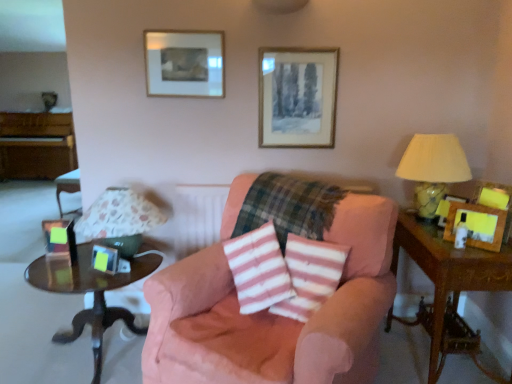
Question: From the image's perspective, is wooden side table at right, marked as the 2th table in a left-to-right arrangement, above or below yellow fabric lampshade at right, the 2th table lamp viewed from the left?

Choices:
 (A) above
 (B) below

Answer: (B)

Question: Considering the positions of wooden side table at right, marked as the 2th table in a left-to-right arrangement, and yellow fabric lampshade at right, the 1th table lamp positioned from the right, in the image, is wooden side table at right, marked as the 2th table in a left-to-right arrangement, wider or thinner than yellow fabric lampshade at right, the 1th table lamp positioned from the right,?

Choices:
 (A) thin
 (B) wide

Answer: (B)

Question: Which object is positioned closest to the plaid fabric at center?

Choices:
 (A) wooden side table at right, marked as the 2th table in a left-to-right arrangement
 (B) metallic silver picture frame at lower left, the 4th picture frame positioned from the back
 (C) wooden picture frame at right, the first picture frame viewed from the right
 (D) wooden side table at left, the 1th table positioned from the left
 (E) pink fabric chair at center

Answer: (E)

Question: Which object is positioned farthest from the wooden picture frame at right, placed as the 3th picture frame when sorted from bottom to top?

Choices:
 (A) wooden picture frame at upper center, which appears as the 5th picture frame when ordered from the bottom
 (B) wooden side table at left, the 1th table positioned from the left
 (C) pink fabric chair at center
 (D) gold-framed picture at upper center, arranged as the 4th picture frame when viewed from the front
 (E) wooden side table at right, the 1th table positioned from the right

Answer: (B)